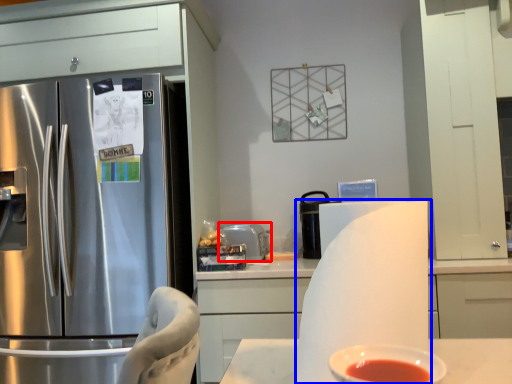
Question: Which point is further to the camera, appliance (highlighted by a red box) or paper towel (highlighted by a blue box)?

Choices:
 (A) appliance
 (B) paper towel

Answer: (A)